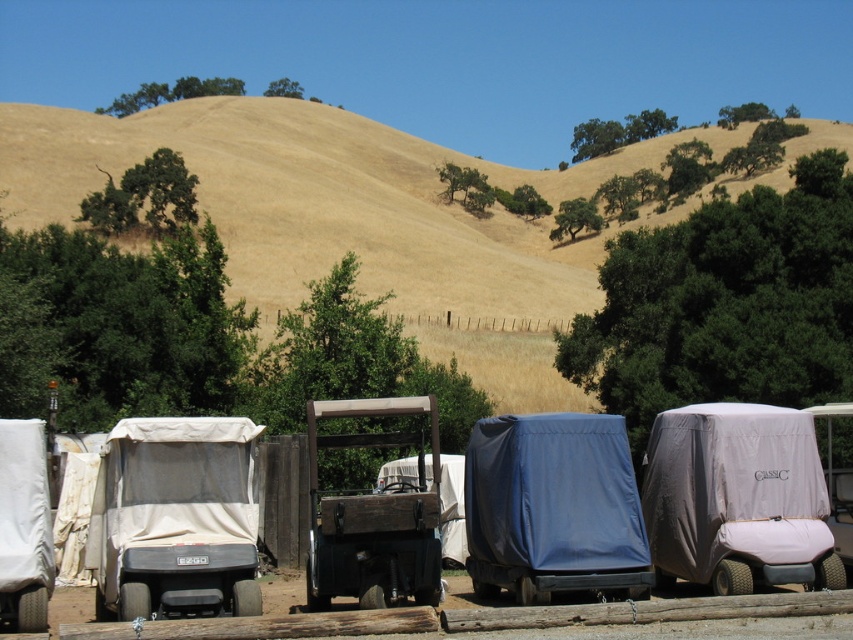
Is dried grass at center positioned behind gray fabric golf cart at center right?

Yes, dried grass at center is further from the viewer.

Which is below, dried grass at center or gray fabric golf cart at center right?

Positioned lower is gray fabric golf cart at center right.

Does point (527, 340) lie in front of point (656, 532)?

No.

Locate an element on the screen. This screenshot has width=853, height=640. dried grass at center is located at coordinates (367, 216).

Is point (221, 602) positioned behind point (833, 524)?

That is False.

Between beige fabric golf cart at left and white matte golf cart at right, which one appears on the right side from the viewer's perspective?

white matte golf cart at right is more to the right.

Where is `beige fabric golf cart at left`? Image resolution: width=853 pixels, height=640 pixels. beige fabric golf cart at left is located at coordinates (175, 518).

Image resolution: width=853 pixels, height=640 pixels. What are the coordinates of `beige fabric golf cart at left` in the screenshot? It's located at (175, 518).

Can you confirm if blue tarp golf cart at center is positioned below white matte golf cart at right?

No.

Locate an element on the screen. The height and width of the screenshot is (640, 853). blue tarp golf cart at center is located at coordinates (553, 508).

Which is in front, point (566, 472) or point (846, 502)?

Point (566, 472) is more forward.

Identify the location of blue tarp golf cart at center. (553, 508).